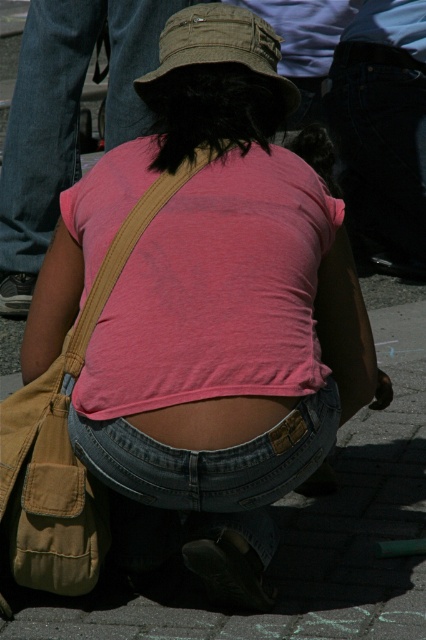
You are standing at the point with coordinates point (69, 420) and want to move to the point with coordinates point (393, 481). Given that you can only move forward in a straight line, will you be able to reach the destination without changing direction?

Point (393, 481) is behind point (69, 420), so moving forward in a straight line from point (69, 420) will not allow you to reach point (393, 481) without changing direction.

You are a photographer trying to capture a candid shot of the person in the scene. Since you want to focus on their face, which object should you adjust your camera focus on first, the khaki fabric hat at center or the matte pink skin at center?

The khaki fabric hat at center is further to the viewer than the matte pink skin at center, so you should focus on the khaki fabric hat at center first to ensure the face is in focus.

You are a delivery person who needs to place a large pizza box on the paved surface. Given that the pizza box is the same size as the khaki fabric hat at center, will it fit on the paved stone pavement at center?

The paved stone pavement at center is larger in size than the khaki fabric hat at center. Since the pizza box is the same size as the hat, it will fit on the paved stone pavement at center.